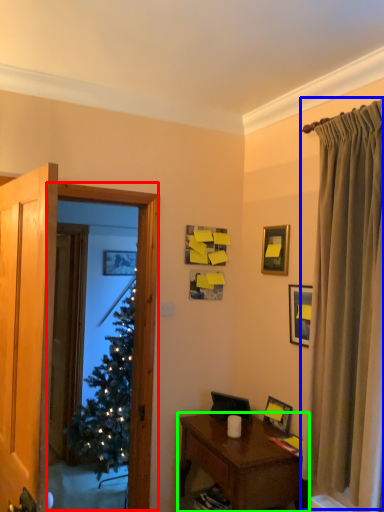
Question: Estimate the real-world distances between objects in this image. Which object is closer to window screen (highlighted by a red box), curtain (highlighted by a blue box) or nightstand (highlighted by a green box)?

Choices:
 (A) curtain
 (B) nightstand

Answer: (B)